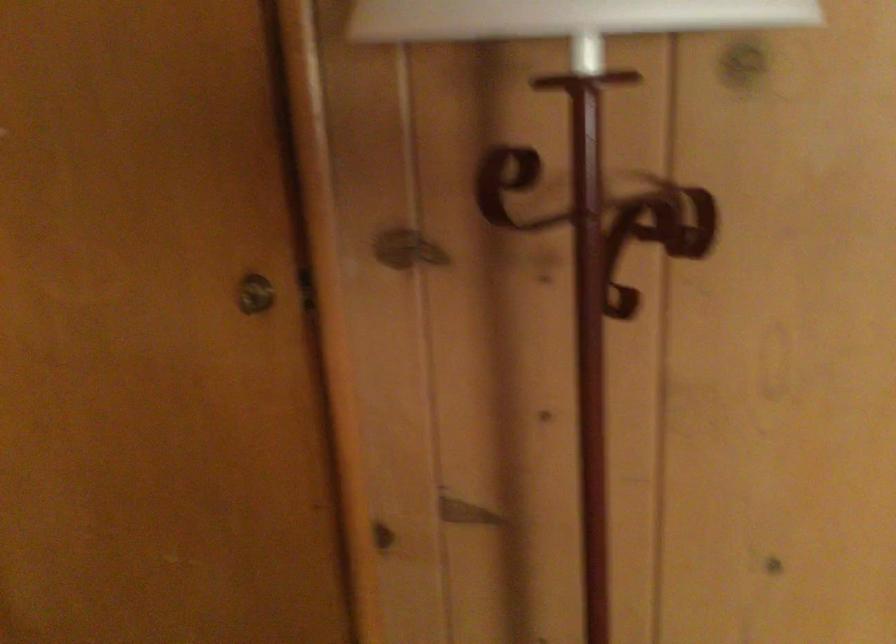
Find where to turn the lamp switch. Please return your answer as a coordinate pair (x, y).

(564, 17)